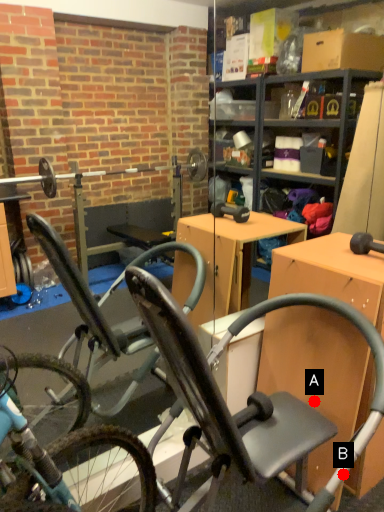
Question: Two points are circled on the image, labeled by A and B beside each circle. Which point is closer to the camera taking this photo?

Choices:
 (A) A is closer
 (B) B is closer

Answer: (B)